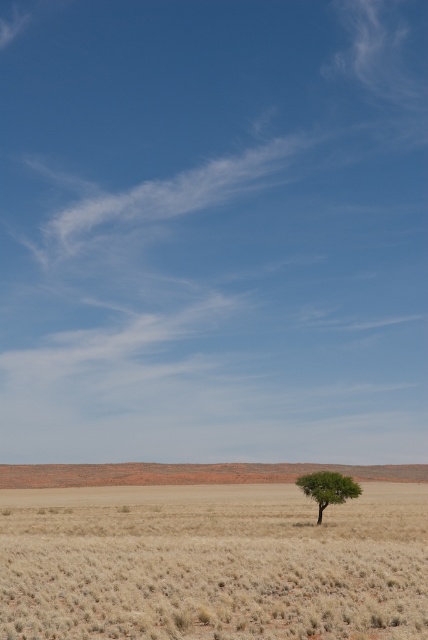
Consider the image. You are a hiker trying to navigate through the dry grass at center and the green leafy tree at center. Which object is taller, requiring you to duck to avoid hitting your head?

The dry grass at center is taller than the green leafy tree at center, so you would need to duck when passing through the dry grass at center to avoid hitting your head.

You are a hiker who wants to walk from the dry grass at center to the green leafy tree at center. Which direction should you move towards to reach the tree?

The dry grass at center is positioned on the left side of the green leafy tree at center. To reach the tree, you should move towards the right direction from the dry grass at center.